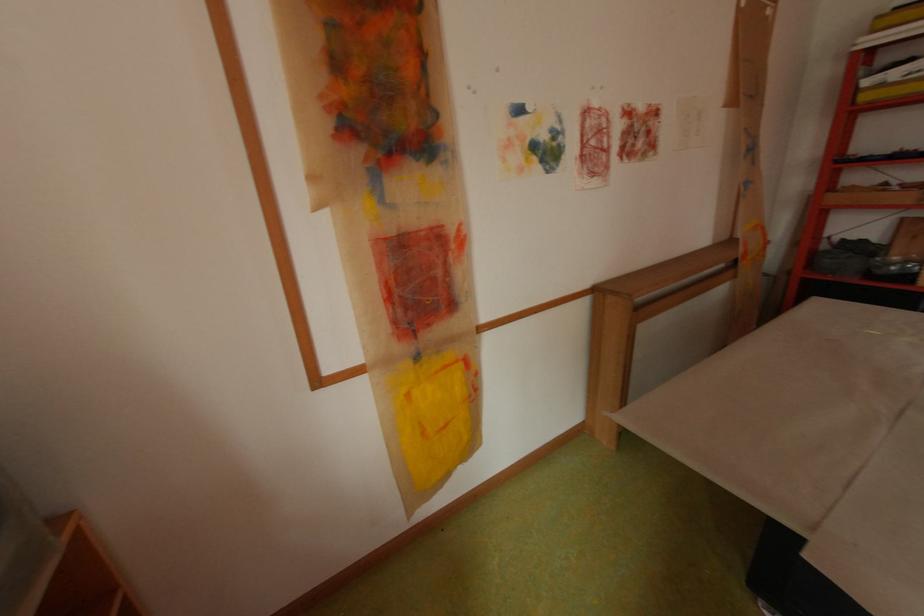
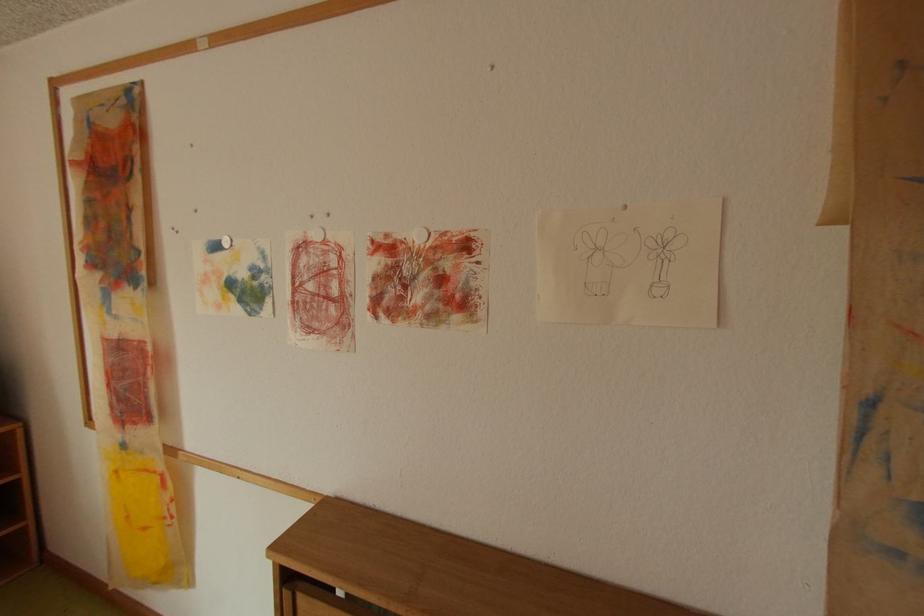
In the second image, find the point that corresponds to the point at 528,111 in the first image.

(225, 246)